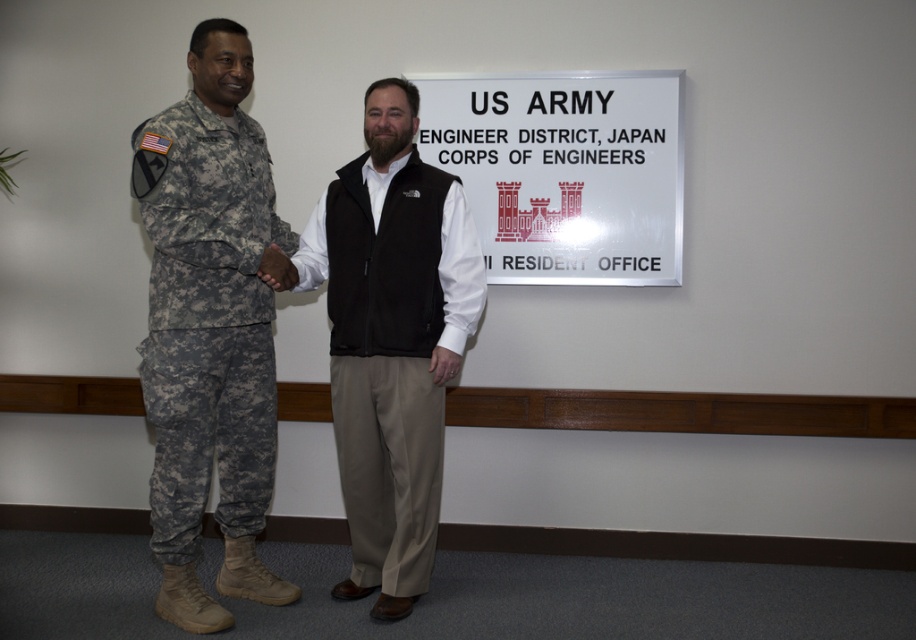
You are a photographer standing in front of the US ARMY ENGINEER DISTRICT sign. You want to take a photo that includes both the point at coordinates point (458, 333) and point (243, 499). Which point should you focus on first to ensure both are in focus?

You should focus on point (458, 333) first because it is closer to the camera than point (243, 499). This ensures the closer point is in focus, and the farther point will also be in focus due to depth of field.

Based on the scene description, which object is taller between the black fleece vest at center and the camouflage fabric uniform at left?

→ The black fleece vest at center is taller than the camouflage fabric uniform at left.